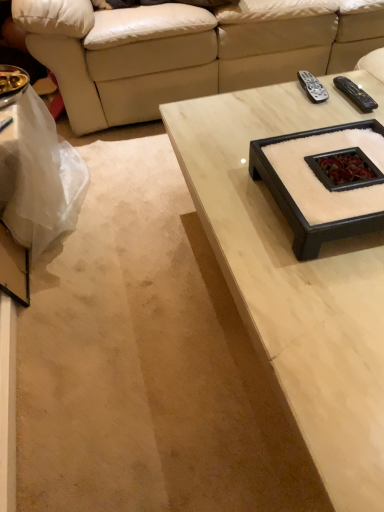
I want to click on blank space above white marble coffee table at upper center (from a real-world perspective), so click(272, 201).